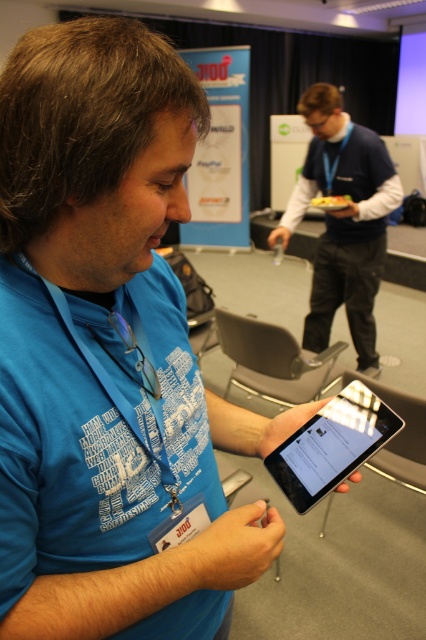
You are standing in the conference room and see the blue fabric shirt at center and the black glossy tablet at center. Which object is positioned to the right side from your perspective?

The blue fabric shirt at center is to the right of the black glossy tablet at center.